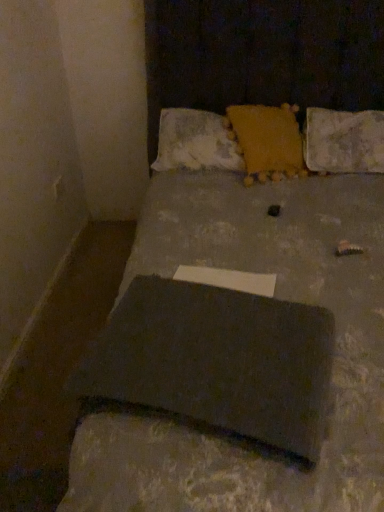
Question: From their relative heights in the image, would you say yellow fuzzy pillow at upper center, placed as the second pillow when sorted from left to right, is taller or shorter than matte gray laptop at center?

Choices:
 (A) short
 (B) tall

Answer: (A)

Question: From the image's perspective, is yellow fuzzy pillow at upper center, the second pillow viewed from the right, above or below matte gray laptop at center?

Choices:
 (A) below
 (B) above

Answer: (B)

Question: Which is farther from the textured yellow pillow at center, which is counted as the first pillow, starting from the left?

Choices:
 (A) textured yellow pillow at upper right, marked as the 3th pillow in a left-to-right arrangement
 (B) matte gray laptop at center
 (C) yellow fuzzy pillow at upper center, placed as the second pillow when sorted from left to right
 (D) slate at center

Answer: (D)

Question: Estimate the real-world distances between objects in this image. Which object is closer to the textured yellow pillow at upper right, marked as the 3th pillow in a left-to-right arrangement?

Choices:
 (A) slate at center
 (B) matte gray laptop at center
 (C) yellow fuzzy pillow at upper center, placed as the second pillow when sorted from left to right
 (D) textured yellow pillow at center, marked as the 3th pillow in a right-to-left arrangement

Answer: (C)